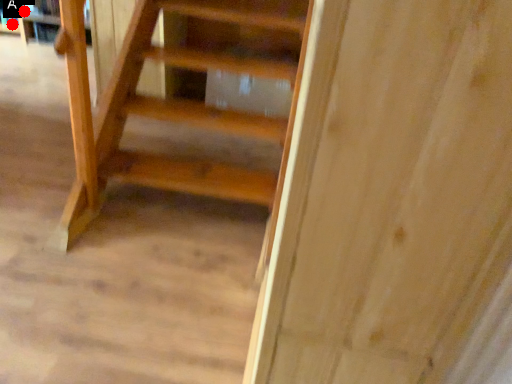
Question: Two points are circled on the image, labeled by A and B beside each circle. Which of the following is the farthest from the observer?

Choices:
 (A) A is further
 (B) B is further

Answer: (A)